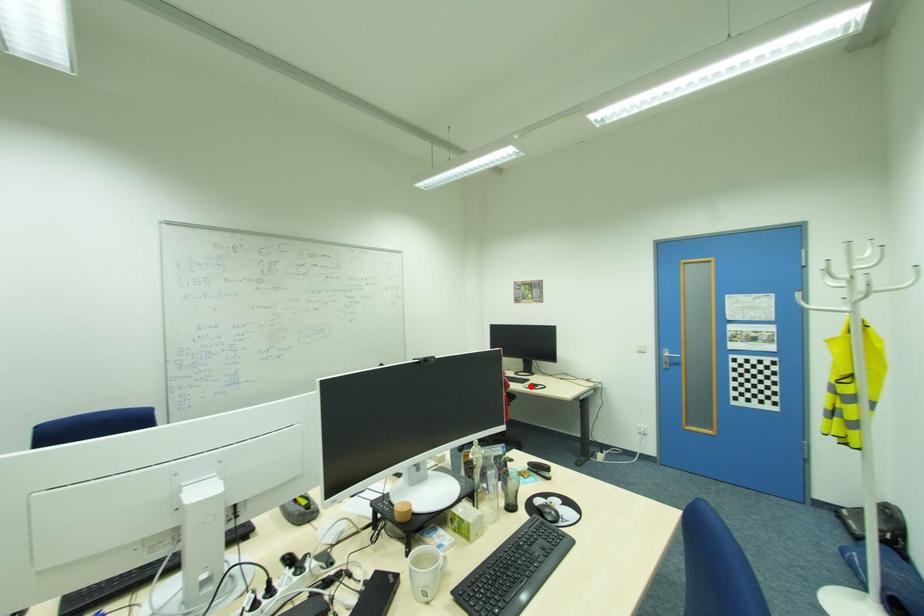
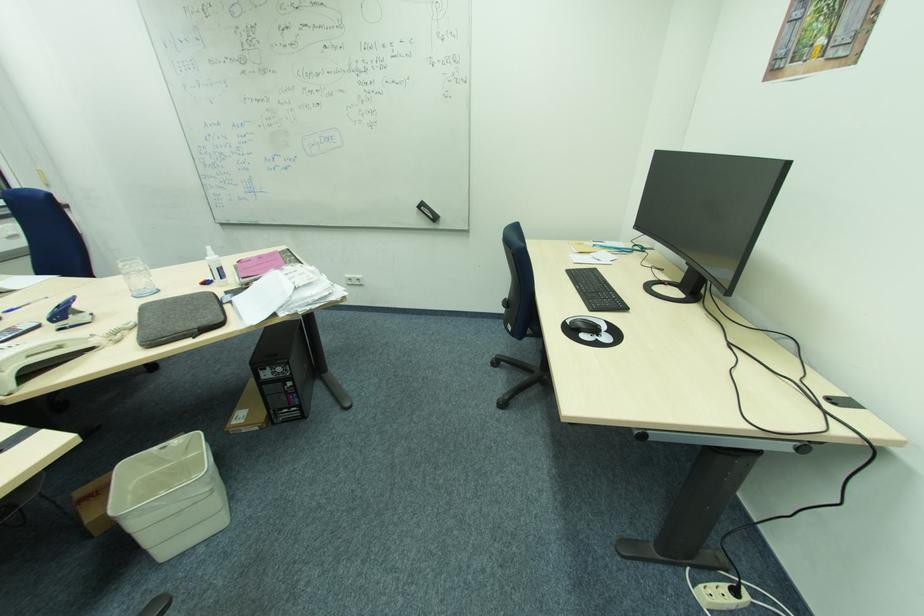
Where in the second image is the point corresponding to the highlighted location from the first image?

(572, 323)